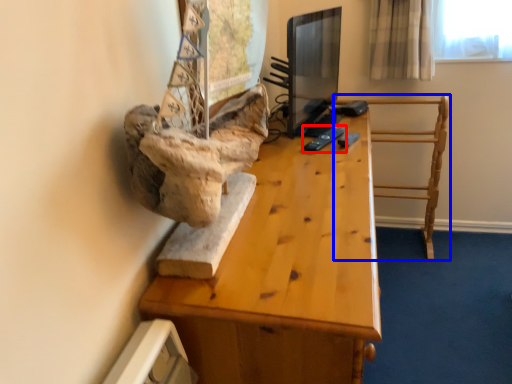
Question: Which object appears farthest to the camera in this image, remote (highlighted by a red box) or furniture (highlighted by a blue box)?

Choices:
 (A) remote
 (B) furniture

Answer: (B)